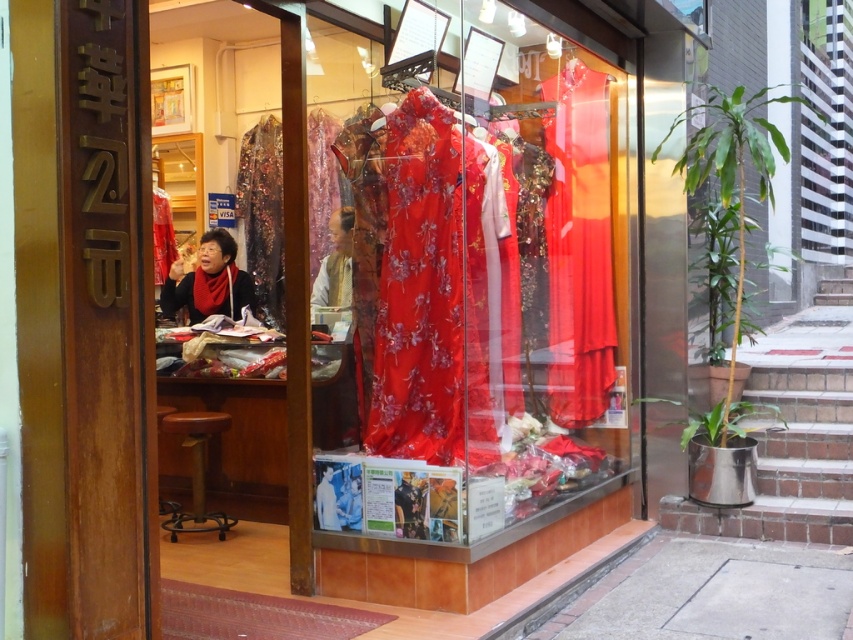
Can you confirm if silky red dress at center is thinner than silky white blouse at center?

In fact, silky red dress at center might be wider than silky white blouse at center.

Is silky red dress at center smaller than silky white blouse at center?

Yes, silky red dress at center is smaller than silky white blouse at center.

Where is `silky red dress at center`? The image size is (853, 640). silky red dress at center is located at coordinates (578, 246).

I want to click on silky red dress at center, so click(x=578, y=246).

Does silky white blouse at center come behind black satin blouse at center?

That is False.

From the picture: Between silky white blouse at center and black satin blouse at center, which one is positioned lower?

silky white blouse at center

Describe the element at coordinates (335, 266) in the screenshot. I see `silky white blouse at center` at that location.

You are a GUI agent. You are given a task and a screenshot of the screen. Output one action in this format:
    pyautogui.click(x=<x>, y=<y>)
    Task: Click on the silky white blouse at center
    
    Given the screenshot: What is the action you would take?
    pyautogui.click(x=335, y=266)

Between silky red dress at center and black satin blouse at center, which one appears on the left side from the viewer's perspective?

black satin blouse at center is more to the left.

Can you confirm if silky red dress at center is smaller than black satin blouse at center?

Incorrect, silky red dress at center is not smaller in size than black satin blouse at center.

Between point (566, 177) and point (236, 275), which one is positioned behind?

The point (236, 275) is behind.

Locate an element on the screen. This screenshot has height=640, width=853. silky red dress at center is located at coordinates (578, 246).